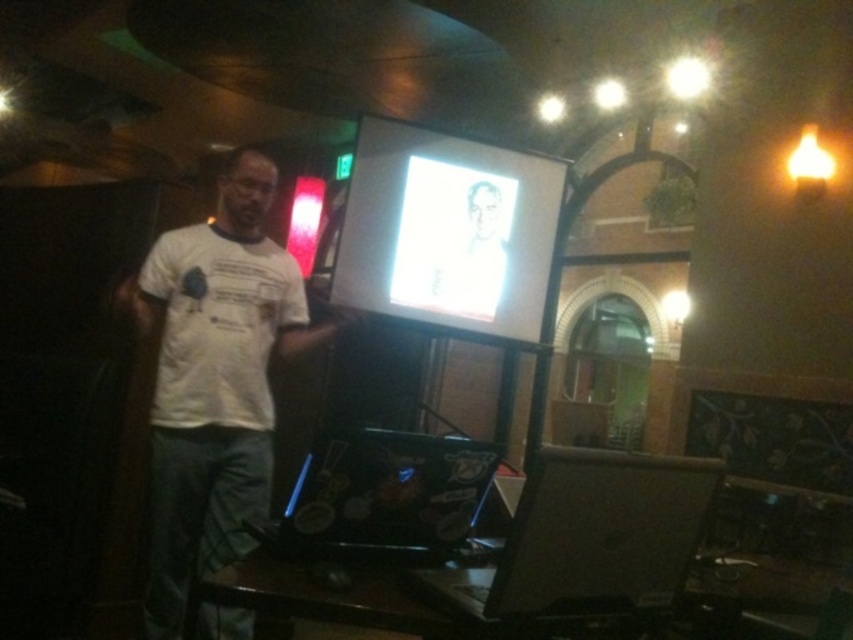
Can you confirm if white glossy projection screen at center is positioned to the left of gray matte portrait at center?

Correct, you'll find white glossy projection screen at center to the left of gray matte portrait at center.

Does white glossy projection screen at center lie in front of gray matte portrait at center?

Yes, white glossy projection screen at center is in front of gray matte portrait at center.

Who is more distant from viewer, [508,227] or [491,262]?

The point [508,227] is more distant.

Locate an element on the screen. Image resolution: width=853 pixels, height=640 pixels. white glossy projection screen at center is located at coordinates (447, 230).

The width and height of the screenshot is (853, 640). I want to click on black glossy laptop at lower center, so point(585,541).

Between black glossy laptop at lower center and shiny black laptop at center, which one has more height?

Standing taller between the two is black glossy laptop at lower center.

Identify the location of black glossy laptop at lower center. (585, 541).

Who is lower down, shiny black laptop at center or gray matte portrait at center?

shiny black laptop at center is lower down.

Consider the image. Is shiny black laptop at center above gray matte portrait at center?

No.

This screenshot has height=640, width=853. Identify the location of shiny black laptop at center. (384, 497).

This screenshot has height=640, width=853. I want to click on shiny black laptop at center, so click(384, 497).